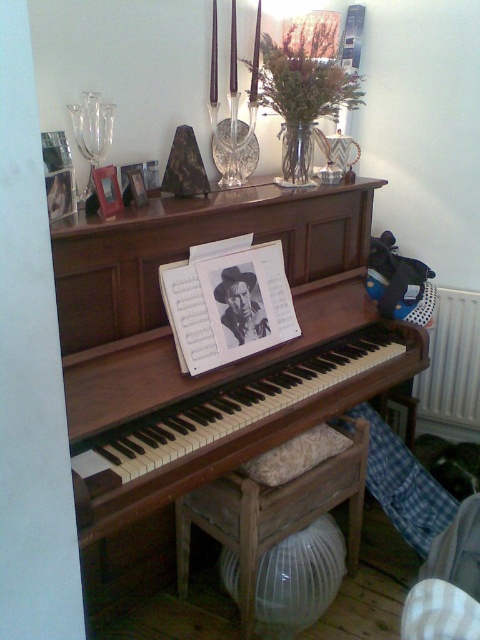
You are standing in the room and want to reach the point at coordinates (x=123, y=289). Given that you are 1.6 meters tall, will you be able to comfortably reach that point without standing on something?

The point at coordinates (x=123, y=289) is 1.55 meters away from the camera. Since you are 1.6 meters tall, you can comfortably reach it without needing to stand on anything.

You are arranging flowers in the vase on the shelf above the piano. You need to place a new vase to the left of the wooden at lower center. Where should you place it relative to the matte wooden picture frame at upper left?

The wooden at lower center is to the right of the matte wooden picture frame at upper left, so placing the new vase to the left of the wooden at lower center would mean placing it to the right of the matte wooden picture frame at upper left.